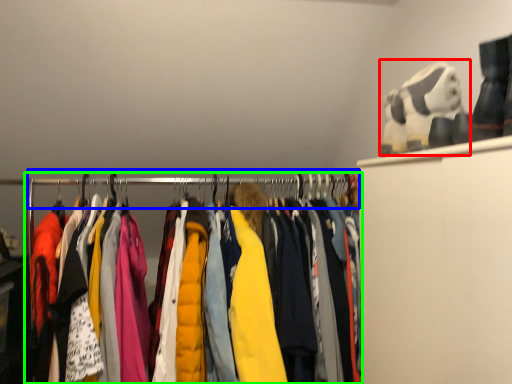
Question: Which is nearer to the toy (highlighted by a red box)? clothesline (highlighted by a blue box) or closet (highlighted by a green box).

Choices:
 (A) clothesline
 (B) closet

Answer: (A)